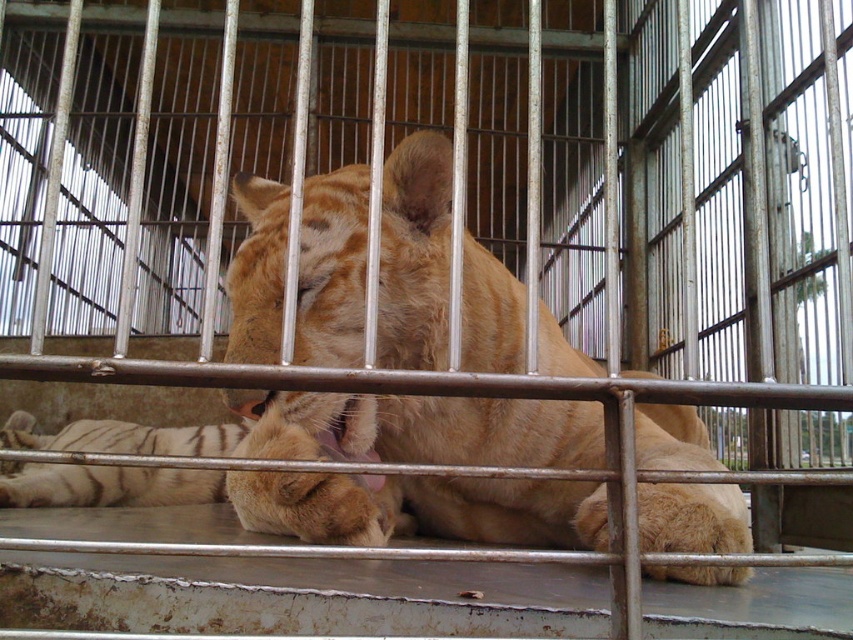
Question: Which of the following is the closest to the observer?

Choices:
 (A) (55, 493)
 (B) (433, 307)

Answer: (B)

Question: Which point appears farthest from the camera in this image?

Choices:
 (A) (479, 516)
 (B) (27, 432)

Answer: (B)

Question: Can you confirm if orange fur tiger at center is positioned below white striped fur at lower left?

Choices:
 (A) yes
 (B) no

Answer: (B)

Question: Is orange fur tiger at center further to the viewer compared to white striped fur at lower left?

Choices:
 (A) no
 (B) yes

Answer: (A)

Question: Can you confirm if orange fur tiger at center is positioned to the right of white striped fur at lower left?

Choices:
 (A) no
 (B) yes

Answer: (B)

Question: Which point is closer to the camera?

Choices:
 (A) white striped fur at lower left
 (B) orange fur tiger at center

Answer: (B)